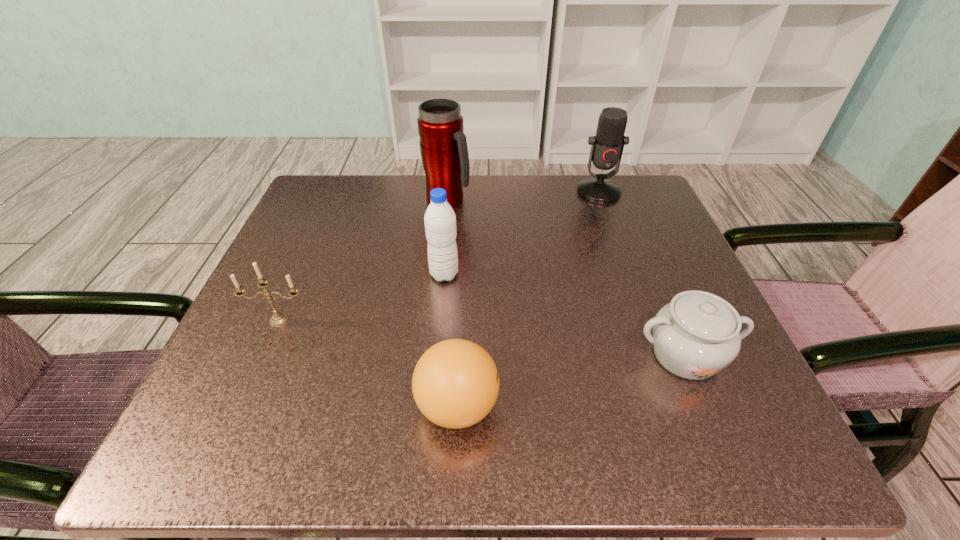
The width and height of the screenshot is (960, 540). Find the location of `thermos bottle`. thermos bottle is located at coordinates (443, 145).

At what (x,y) coordinates should I click in order to perform the action: click on microphone. Please return your answer as a coordinate pair (x, y). The height and width of the screenshot is (540, 960). Looking at the image, I should click on (607, 146).

Identify the location of water bottle. The height and width of the screenshot is (540, 960). (440, 220).

Identify the location of candle. The height and width of the screenshot is (540, 960). tap(278, 318).

The image size is (960, 540). In order to click on ping-pong ball in this screenshot , I will do `click(455, 384)`.

The height and width of the screenshot is (540, 960). I want to click on chinaware, so click(695, 336).

Image resolution: width=960 pixels, height=540 pixels. In order to click on vacant space situated 0.330m on the side with the handle of the thermos bottle in this screenshot , I will do `click(612, 201)`.

You are a GUI agent. You are given a task and a screenshot of the screen. Output one action in this format:
    pyautogui.click(x=<x>, y=<y>)
    Task: Click on the blank space located on the side of the microphone with the red ring
    This screenshot has width=960, height=540.
    Given the screenshot: What is the action you would take?
    click(609, 219)

Find the location of `free region located on the back of the water bottle`. free region located on the back of the water bottle is located at coordinates (448, 231).

At what (x,y) coordinates should I click in order to perform the action: click on vacant space positioned on the back of the candle. Please return your answer as a coordinate pair (x, y). Looking at the image, I should click on (300, 271).